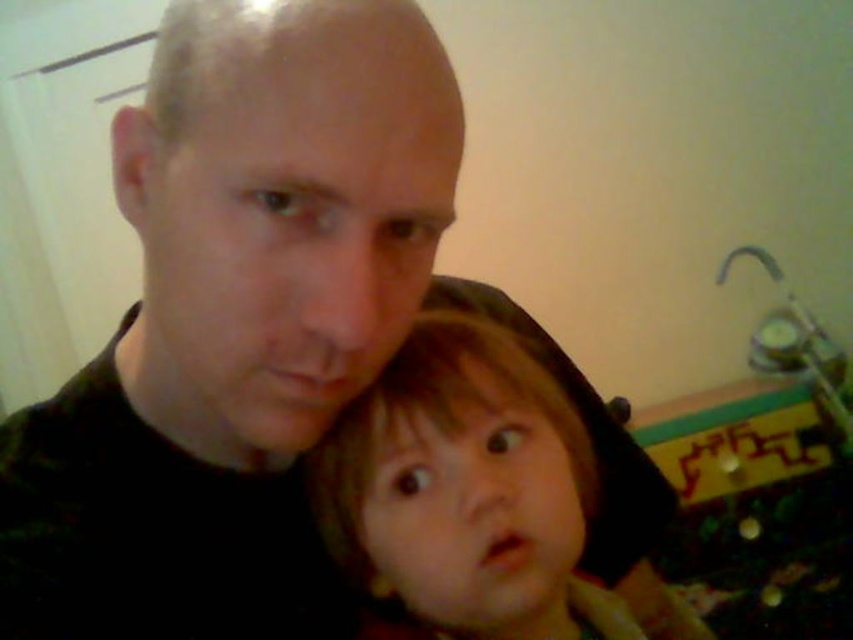
How far apart are black matte shirt at center and smooth brown hair at center?

black matte shirt at center is 4.65 inches away from smooth brown hair at center.

Does point (305, 113) come behind point (543, 458)?

No.

Locate an element on the screen. black matte shirt at center is located at coordinates (234, 323).